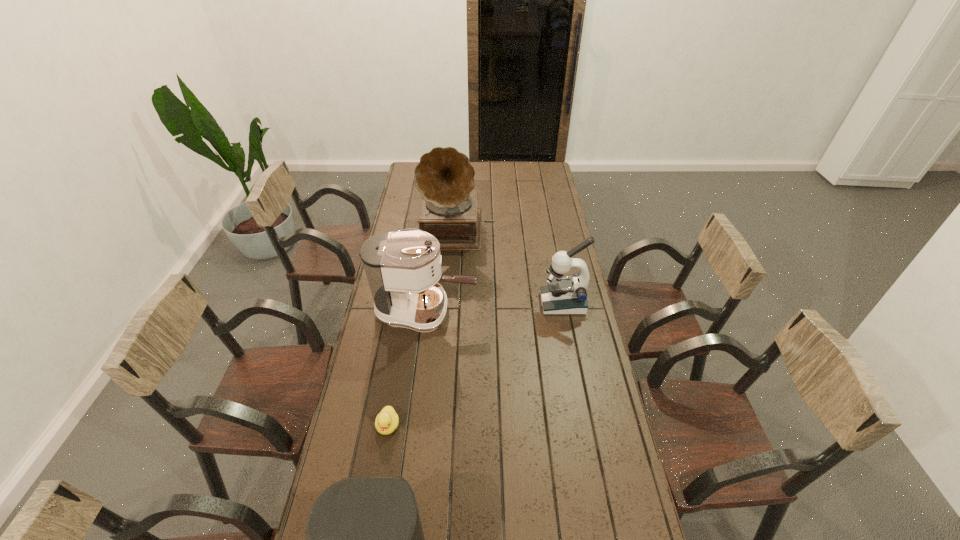
The width and height of the screenshot is (960, 540). I want to click on record player, so click(x=444, y=176).

What are the coordinates of `the tallest object` in the screenshot? It's located at 444,176.

The image size is (960, 540). In order to click on the farther coffee maker in this screenshot , I will do point(402,268).

Where is `the rightmost object`? the rightmost object is located at coordinates (563, 295).

At what (x,y) coordinates should I click in order to perform the action: click on the shortest object. Please return your answer as a coordinate pair (x, y). This screenshot has width=960, height=540. Looking at the image, I should click on (387, 420).

Locate an element on the screen. the fourth farthest object is located at coordinates (387, 420).

The width and height of the screenshot is (960, 540). I want to click on free space located 0.220m from the horn of the record player, so click(453, 282).

Identify the location of blank space located 0.080m on the front-facing side of the farther coffee maker. (497, 311).

Where is `vacant space situated at the eyepiece of the microscope`? vacant space situated at the eyepiece of the microscope is located at coordinates (492, 303).

What are the coordinates of `free space located at the eyepiece of the microscope` in the screenshot? It's located at (506, 303).